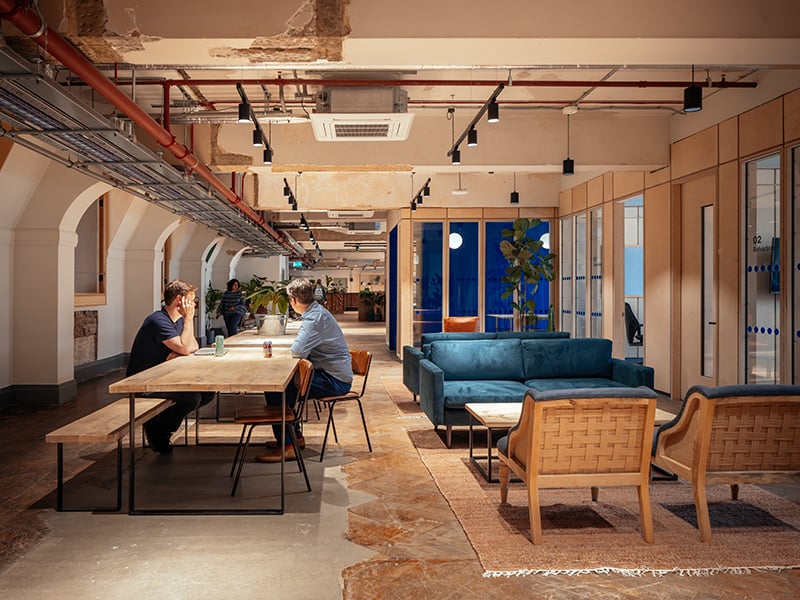
The image size is (800, 600). I want to click on tables, so click(509, 403), click(264, 385), click(252, 336).